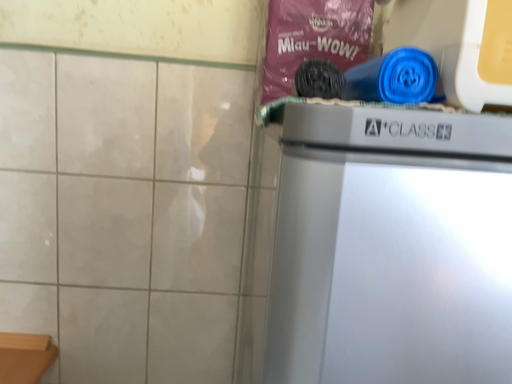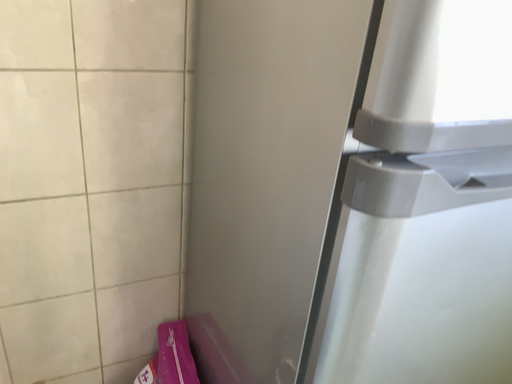
Question: Which way did the camera rotate in the video?

Choices:
 (A) rotated upward
 (B) rotated downward

Answer: (B)